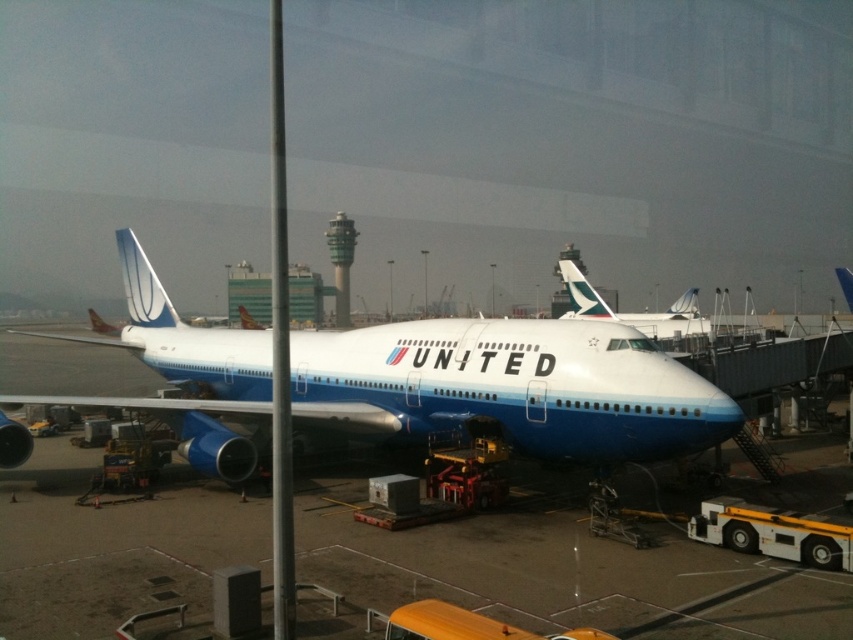
Question: Which object is farther from the camera taking this photo?

Choices:
 (A) blue polished airplane at center
 (B) white glossy airplane at center

Answer: (A)

Question: Is white glossy airplane at center further to camera compared to blue polished airplane at center?

Choices:
 (A) yes
 (B) no

Answer: (B)

Question: Which point is closer to the camera taking this photo?

Choices:
 (A) (648, 317)
 (B) (38, 401)

Answer: (B)

Question: Is white glossy airplane at center above blue polished airplane at center?

Choices:
 (A) yes
 (B) no

Answer: (B)

Question: Can you confirm if white glossy airplane at center is positioned to the left of blue polished airplane at center?

Choices:
 (A) yes
 (B) no

Answer: (A)